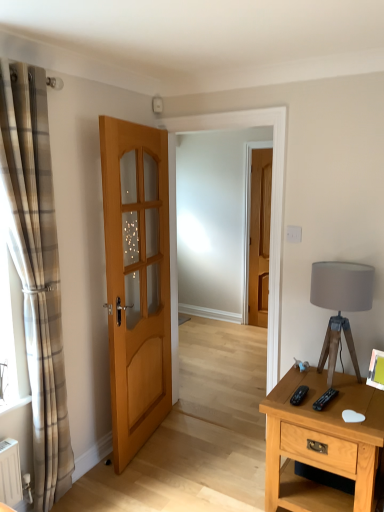
The height and width of the screenshot is (512, 384). Identify the location of vacant space in front of light brown wooden door at center, the second door from the right. (154, 477).